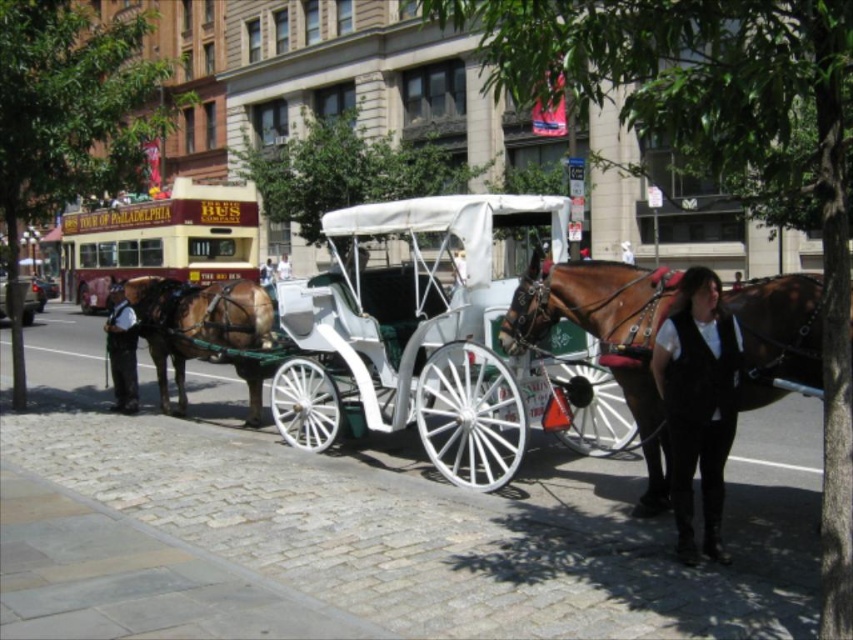
Question: Which point is closer to the camera?

Choices:
 (A) white polished wood horse cart at center
 (B) brown glossy horse at center

Answer: (A)

Question: Is white polished wood coach at center smaller than brown glossy horse at left?

Choices:
 (A) no
 (B) yes

Answer: (A)

Question: Estimate the real-world distances between objects in this image. Which object is farther from the brown glossy horse at left?

Choices:
 (A) white polished wood coach at center
 (B) shiny black coach at center
 (C) white polished wood horse cart at center

Answer: (A)

Question: Among these points, which one is farthest from the camera?

Choices:
 (A) (770, 376)
 (B) (111, 346)
 (C) (660, 380)
 (D) (178, 346)

Answer: (B)

Question: Is white polished wood horse cart at center further to the viewer compared to shiny black coach at center?

Choices:
 (A) no
 (B) yes

Answer: (A)

Question: Is white polished wood coach at center wider than brown glossy horse at left?

Choices:
 (A) no
 (B) yes

Answer: (A)